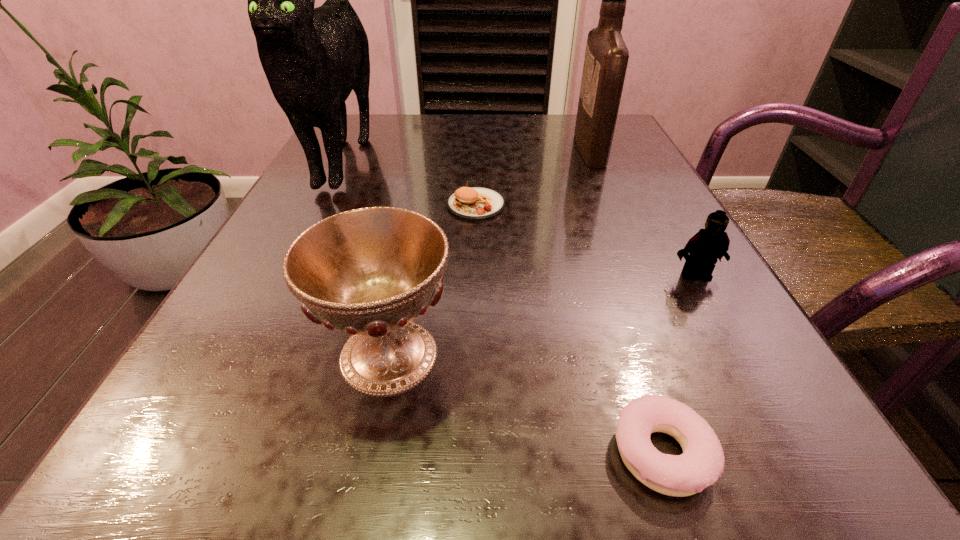
Image resolution: width=960 pixels, height=540 pixels. Identify the location of the leftmost object. (313, 58).

Locate an element on the screen. This screenshot has width=960, height=540. cat is located at coordinates (313, 58).

Identify the location of liquor. This screenshot has height=540, width=960. (606, 58).

Find the location of `chalice`. chalice is located at coordinates (370, 272).

Image resolution: width=960 pixels, height=540 pixels. Find the location of `the third shortest object`. the third shortest object is located at coordinates (708, 245).

Where is `the rightmost object`? Image resolution: width=960 pixels, height=540 pixels. the rightmost object is located at coordinates (x=708, y=245).

This screenshot has height=540, width=960. In order to click on patty in this screenshot , I will do `click(469, 203)`.

This screenshot has height=540, width=960. Find the location of `the shortest object`. the shortest object is located at coordinates (701, 464).

The width and height of the screenshot is (960, 540). I want to click on vacant space situated 0.150m on the face of the leftmost object, so click(289, 269).

At what (x,y) coordinates should I click in order to perform the action: click on vacant space located on the label side of the second tallest object. Please return your answer as a coordinate pair (x, y). Looking at the image, I should click on (493, 150).